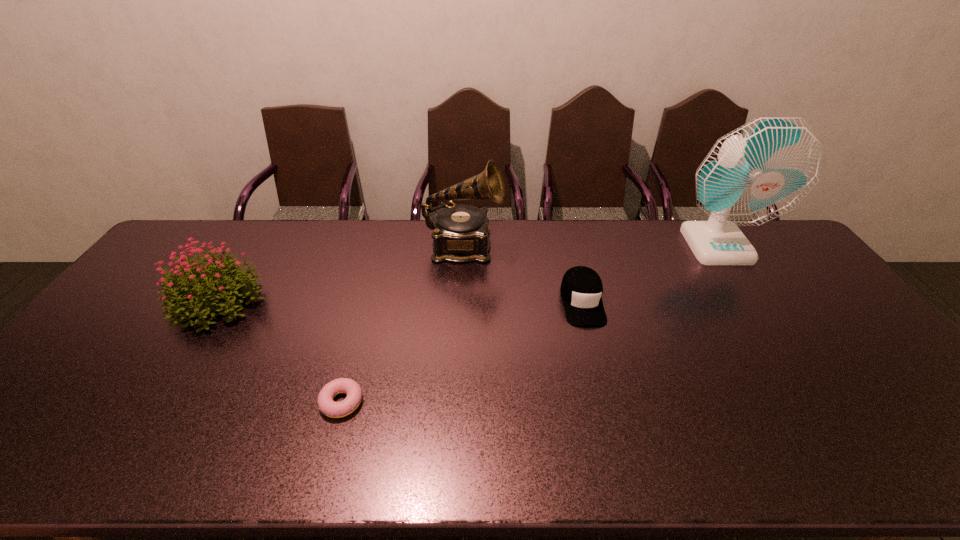
The image size is (960, 540). In order to click on vacant space located 0.240m in front of the rightmost object to face the airflow in this screenshot , I will do `click(766, 320)`.

You are a GUI agent. You are given a task and a screenshot of the screen. Output one action in this format:
    pyautogui.click(x=<x>, y=<y>)
    Task: Click on the free space located on the horn of the third object from right to left
    The height and width of the screenshot is (540, 960).
    Given the screenshot: What is the action you would take?
    pyautogui.click(x=584, y=247)

Locate an element on the screen. The width and height of the screenshot is (960, 540). free space located 0.340m on the right of the leftmost object is located at coordinates (380, 301).

Locate an element on the screen. The height and width of the screenshot is (540, 960). vacant space located on the front-facing side of the cap is located at coordinates (612, 421).

Find the location of a particular element. This screenshot has height=540, width=960. vacant space located 0.060m on the back of the doughnut is located at coordinates (351, 364).

Where is `fan present at the far edge`? Image resolution: width=960 pixels, height=540 pixels. fan present at the far edge is located at coordinates (763, 169).

Locate an element on the screen. The height and width of the screenshot is (540, 960). phonograph record positioned at the far edge is located at coordinates pyautogui.click(x=460, y=234).

I want to click on object located at the left edge, so click(x=188, y=290).

Locate an element on the screen. This screenshot has height=540, width=960. object positioned at the right edge is located at coordinates (763, 169).

The width and height of the screenshot is (960, 540). In order to click on object that is at the far right corner in this screenshot , I will do `click(763, 169)`.